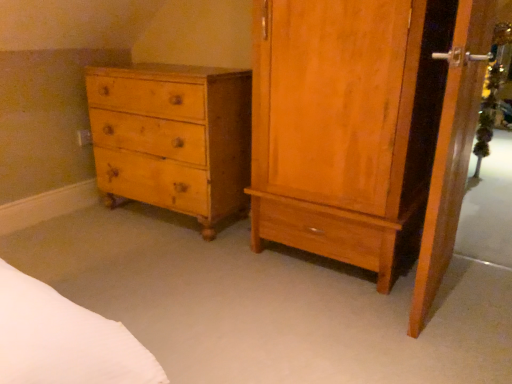
Question: From the image's perspective, does light brown wood cabinet at right appear lower than yellow wood chest of drawers at left?

Choices:
 (A) yes
 (B) no

Answer: (A)

Question: Does light brown wood cabinet at right have a greater width compared to yellow wood chest of drawers at left?

Choices:
 (A) yes
 (B) no

Answer: (A)

Question: Are light brown wood cabinet at right and yellow wood chest of drawers at left far apart?

Choices:
 (A) yes
 (B) no

Answer: (B)

Question: Considering the relative positions of light brown wood cabinet at right and yellow wood chest of drawers at left in the image provided, is light brown wood cabinet at right to the left of yellow wood chest of drawers at left from the viewer's perspective?

Choices:
 (A) yes
 (B) no

Answer: (B)

Question: Is light brown wood cabinet at right behind yellow wood chest of drawers at left?

Choices:
 (A) no
 (B) yes

Answer: (A)

Question: Is light brown wood cabinet at right aimed at yellow wood chest of drawers at left?

Choices:
 (A) no
 (B) yes

Answer: (A)

Question: From a real-world perspective, is wooden screen door at right on yellow wood chest of drawers at left?

Choices:
 (A) yes
 (B) no

Answer: (A)

Question: Could you tell me if wooden screen door at right is facing yellow wood chest of drawers at left?

Choices:
 (A) yes
 (B) no

Answer: (B)

Question: Is wooden screen door at right placed right next to yellow wood chest of drawers at left?

Choices:
 (A) no
 (B) yes

Answer: (A)

Question: Does wooden screen door at right have a larger size compared to yellow wood chest of drawers at left?

Choices:
 (A) yes
 (B) no

Answer: (B)

Question: From a real-world perspective, is wooden screen door at right under yellow wood chest of drawers at left?

Choices:
 (A) no
 (B) yes

Answer: (A)

Question: Considering the relative sizes of wooden screen door at right and yellow wood chest of drawers at left in the image provided, is wooden screen door at right taller than yellow wood chest of drawers at left?

Choices:
 (A) yes
 (B) no

Answer: (A)

Question: Considering the relative sizes of light brown wood cabinet at right and wooden screen door at right in the image provided, is light brown wood cabinet at right thinner than wooden screen door at right?

Choices:
 (A) yes
 (B) no

Answer: (B)